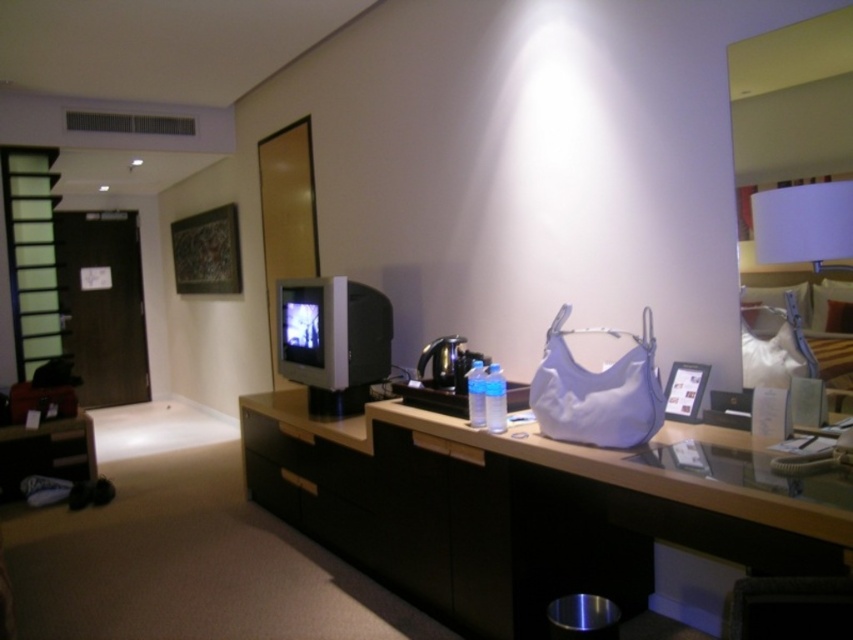
Who is positioned more to the left, matte black counter top at center or white matte lampshade at upper right?

Positioned to the left is matte black counter top at center.

Does point (625, 600) lie in front of point (815, 205)?

No.

Does point (393, 580) come behind point (769, 262)?

Yes, point (393, 580) is farther from viewer.

Image resolution: width=853 pixels, height=640 pixels. Identify the location of matte black counter top at center. (532, 512).

How far apart are matte black counter top at center and black matte drawer at center?

matte black counter top at center and black matte drawer at center are 24.91 inches apart from each other.

Between matte black counter top at center and black matte drawer at center, which one appears on the right side from the viewer's perspective?

matte black counter top at center

The width and height of the screenshot is (853, 640). Identify the location of matte black counter top at center. (532, 512).

Is point (323, 525) farther from viewer compared to point (766, 310)?

Yes, point (323, 525) is behind point (766, 310).

Based on the photo, who is more forward, (538,465) or (752,301)?

Positioned in front is point (538,465).

Between point (718, 506) and point (744, 316), which one is positioned behind?

The point (744, 316) is behind.

Locate an element on the screen. This screenshot has height=640, width=853. matte black counter top at center is located at coordinates (532, 512).